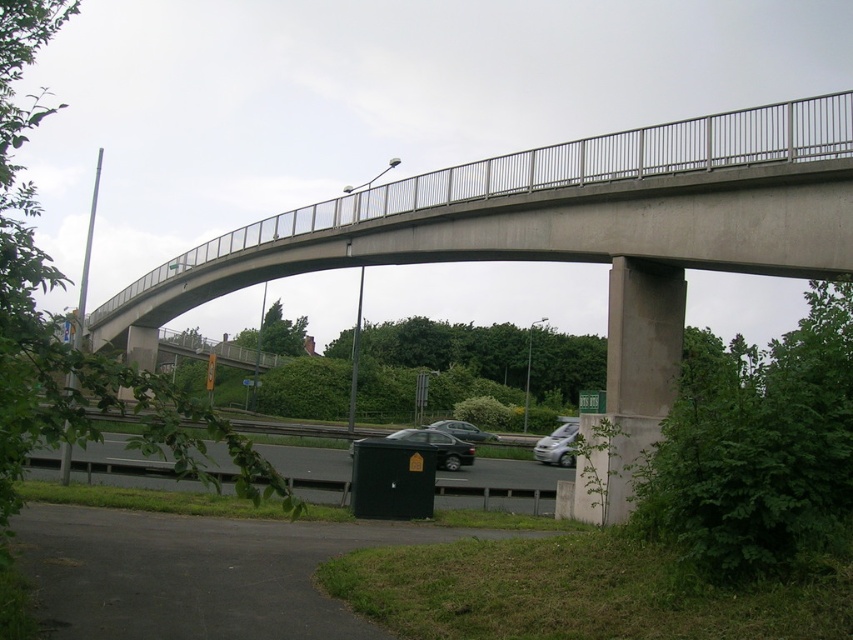
Is satin silver car at lower center to the right of metallic gray sedan at center from the viewer's perspective?

Indeed, satin silver car at lower center is positioned on the right side of metallic gray sedan at center.

Image resolution: width=853 pixels, height=640 pixels. In order to click on satin silver car at lower center in this screenshot , I will do pos(556,445).

Where is `satin silver car at lower center`? Image resolution: width=853 pixels, height=640 pixels. satin silver car at lower center is located at coordinates (556, 445).

Between concrete bridge at center and satin silver car at lower center, which one is positioned higher?

Positioned higher is concrete bridge at center.

Is point (184, 289) closer to camera compared to point (561, 424)?

Yes, point (184, 289) is in front of point (561, 424).

Locate an element on the screen. This screenshot has width=853, height=640. concrete bridge at center is located at coordinates (567, 241).

Between concrete bridge at center and metallic gray sedan at center, which one is positioned higher?

concrete bridge at center

Identify the location of concrete bridge at center. This screenshot has height=640, width=853. (567, 241).